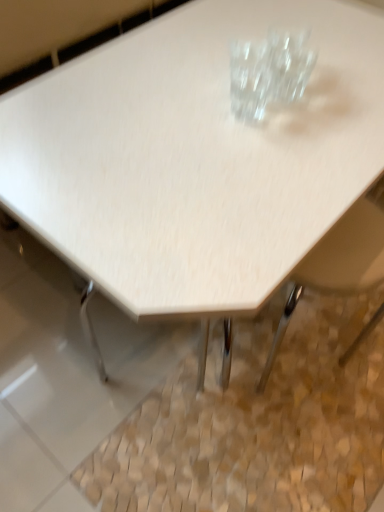
I want to click on free region on the left part of metallic silver chair at lower right, so click(199, 423).